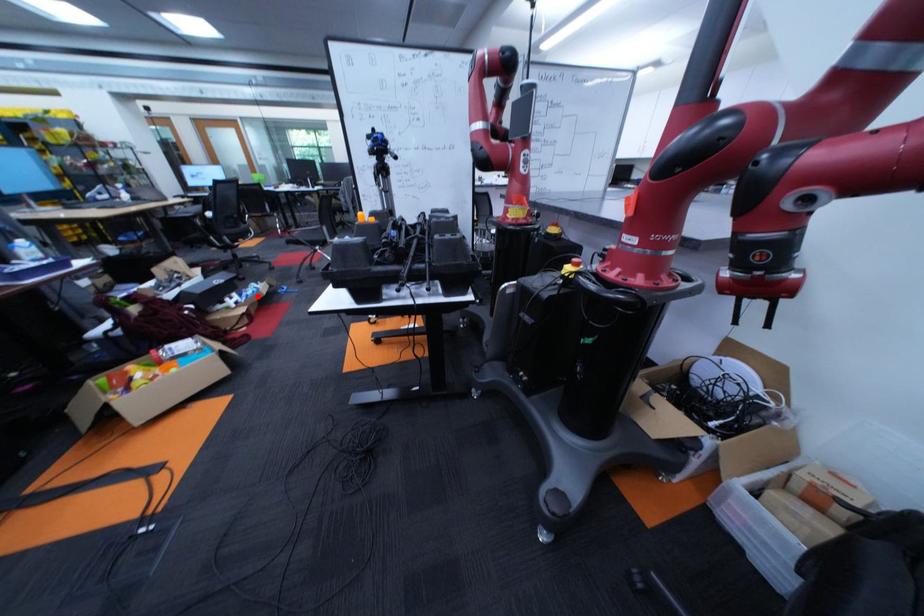
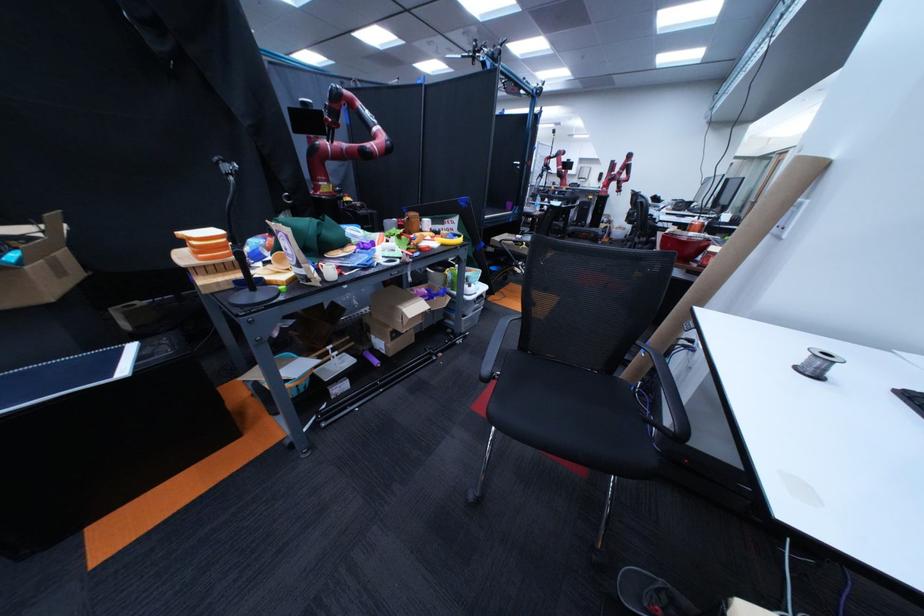
Question: I am providing you with two images of the same scene from different viewpoints. A red point is marked on the first image. Can you still see the location of the red point in image 2?

Choices:
 (A) Yes
 (B) No

Answer: (B)